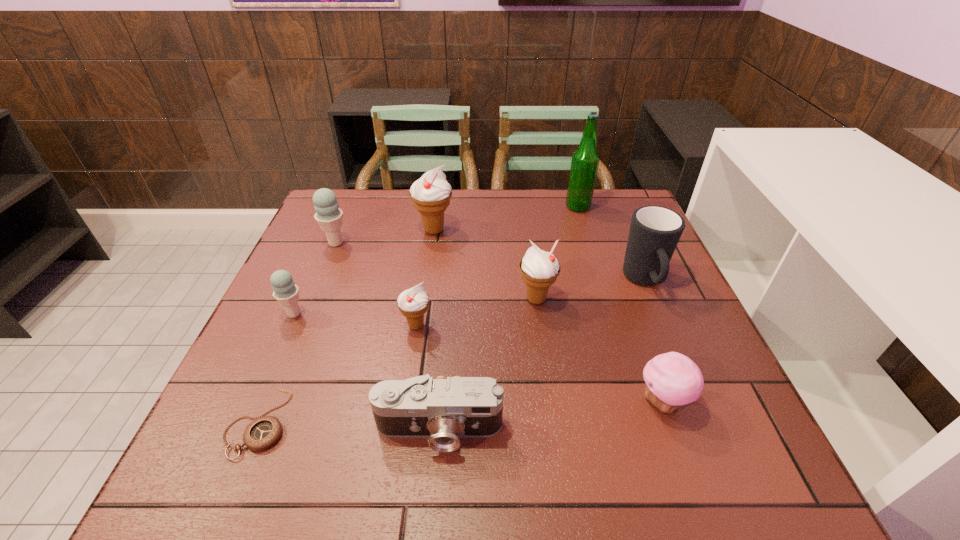
You are a GUI agent. You are given a task and a screenshot of the screen. Output one action in this format:
    pyautogui.click(x=<x>, y=<y>)
    Task: Click on the mug that is at the right edge
    This screenshot has width=960, height=540.
    Given the screenshot: What is the action you would take?
    pyautogui.click(x=654, y=233)

The image size is (960, 540). Find the location of `cupcake that is positioned at the right edge`. cupcake that is positioned at the right edge is located at coordinates (672, 379).

Identify the location of object at the near left corner. (263, 432).

The image size is (960, 540). I want to click on object that is at the far right corner, so click(x=585, y=160).

The height and width of the screenshot is (540, 960). I want to click on vacant space at the far edge of the desktop, so click(x=545, y=194).

What are the coordinates of `vacant area at the near edge of the desktop` in the screenshot? It's located at (379, 451).

This screenshot has width=960, height=540. Identify the location of free space at the left edge. (233, 432).

Find the location of `blank space at the right edge of the desktop`. blank space at the right edge of the desktop is located at coordinates (620, 272).

What are the coordinates of `blank area at the far left corner` in the screenshot? It's located at (363, 190).

This screenshot has height=540, width=960. What are the coordinates of `free area in between the mug and the seventh object from left to right` in the screenshot? It's located at click(590, 291).